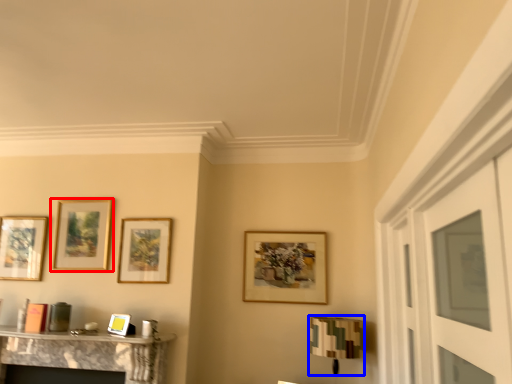
Question: Among these objects, which one is farthest to the camera, picture frame (highlighted by a red box) or lamp (highlighted by a blue box)?

Choices:
 (A) picture frame
 (B) lamp

Answer: (A)